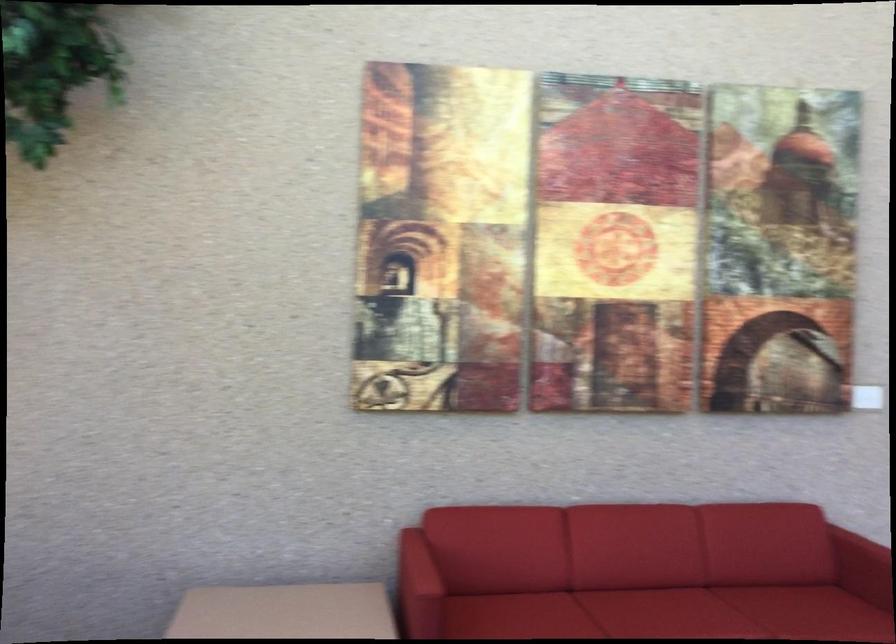
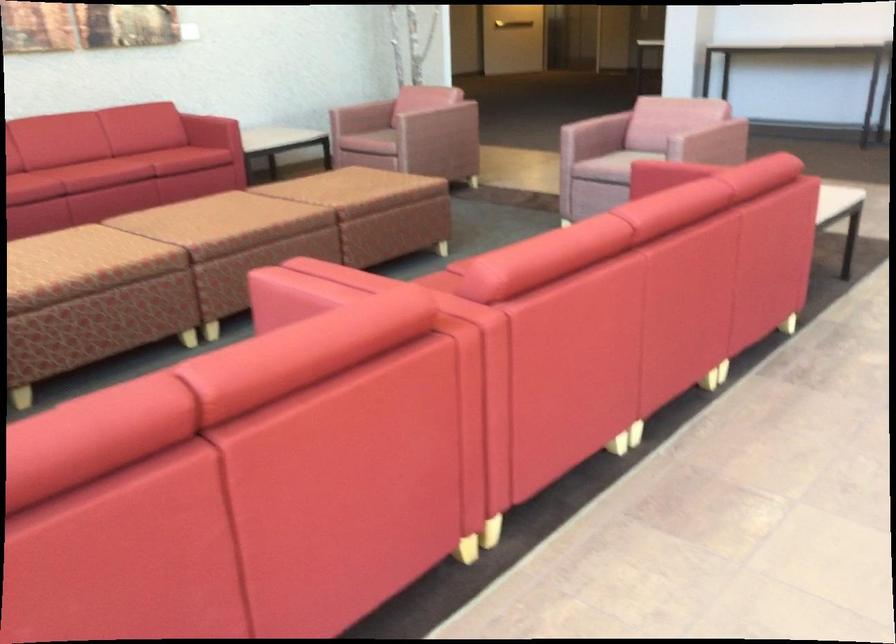
Question: I am providing you with two images of the same scene from different viewpoints. After the viewpoint changes to image2, which objects are now occluded?

Choices:
 (A) red sofa armrest
 (B) patterned brown ottoman
 (C) horizontal door handle
 (D) black conference phone

Answer: (A)